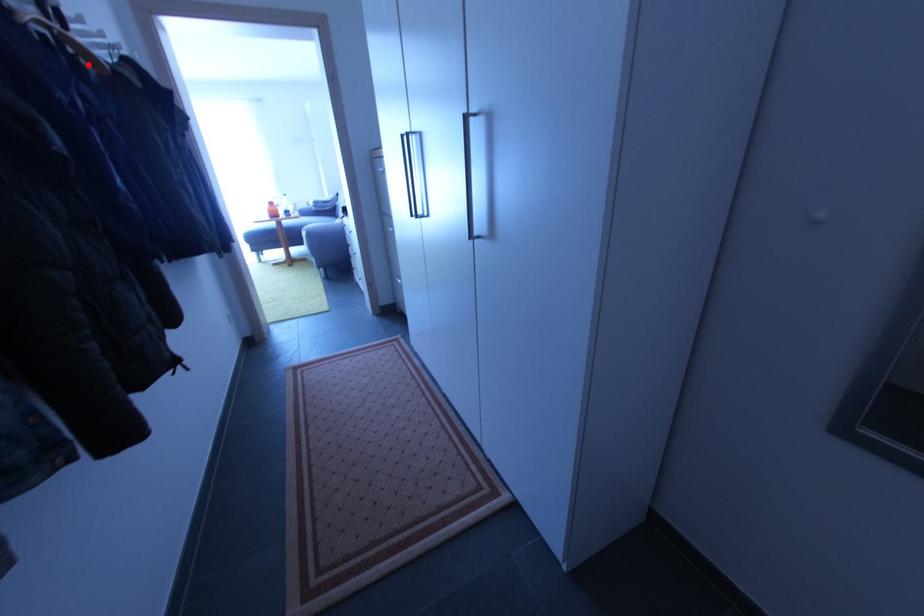
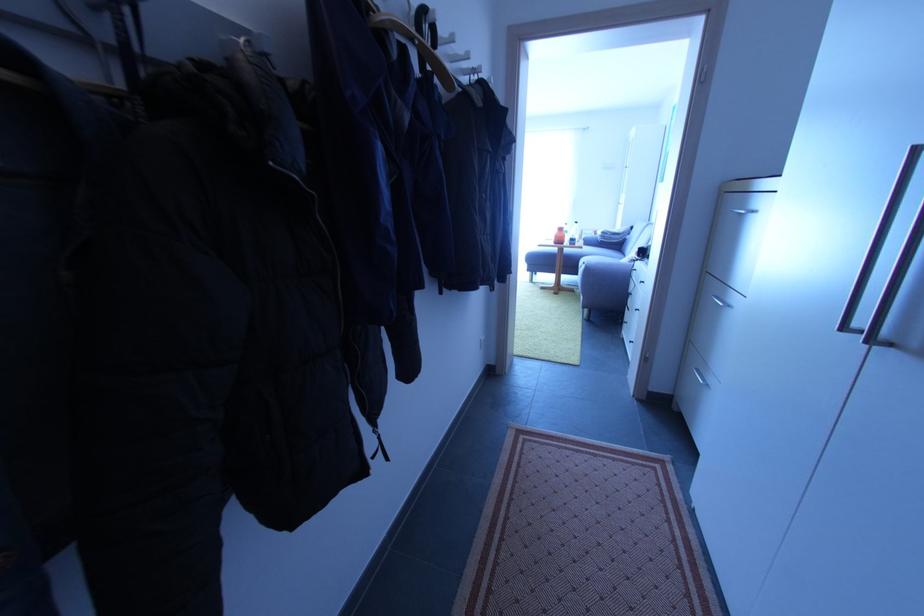
Question: I am providing you with two images of the same scene from different viewpoints. A red point is shown in image1. For the corresponding object point in image2, is it positioned nearer or farther from the camera?

Choices:
 (A) Nearer
 (B) Farther

Answer: (A)